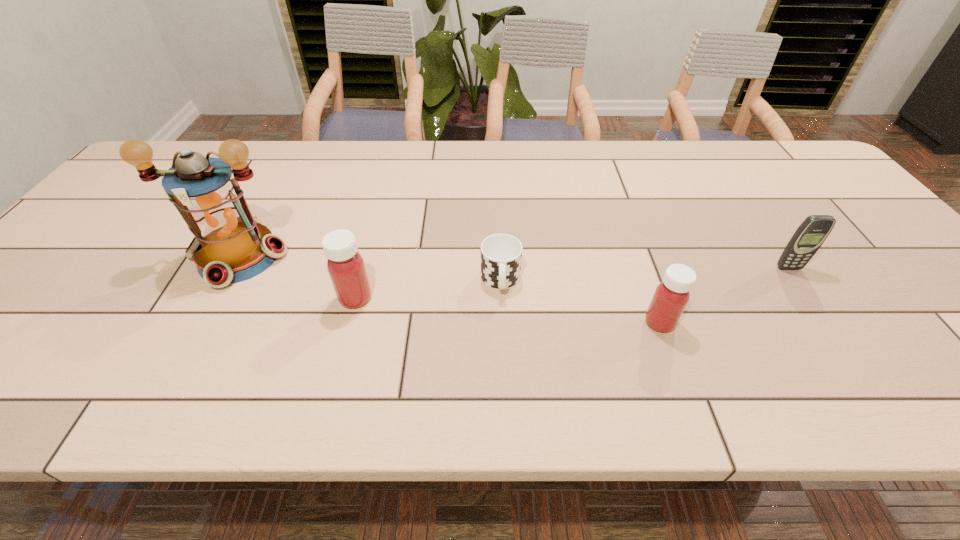
Locate an element on the screen. vacant region located on the screen of the cellular telephone is located at coordinates (848, 355).

Locate an element on the screen. vacant space located 0.100m on the side of the cup with the handle is located at coordinates (503, 338).

You are a GUI agent. You are given a task and a screenshot of the screen. Output one action in this format:
    pyautogui.click(x=<x>, y=<y>)
    Task: Click on the object that is at the near edge
    This screenshot has height=540, width=960.
    Given the screenshot: What is the action you would take?
    pyautogui.click(x=671, y=296)

In the image, there is a desktop. What are the coordinates of `blank space at the far edge` in the screenshot? It's located at (288, 143).

The image size is (960, 540). In order to click on vacant space at the near edge of the desktop in this screenshot , I will do `click(481, 334)`.

Where is `free space at the left edge`? The width and height of the screenshot is (960, 540). free space at the left edge is located at coordinates (84, 268).

In the image, there is a desktop. Identify the location of free space at the right edge. Image resolution: width=960 pixels, height=540 pixels. (849, 204).

You are a GUI agent. You are given a task and a screenshot of the screen. Output one action in this format:
    pyautogui.click(x=<x>, y=<y>)
    Task: Click on the free space at the far right corner
    
    Given the screenshot: What is the action you would take?
    pyautogui.click(x=772, y=158)

In the image, there is a desktop. At what (x,y) coordinates should I click in order to perform the action: click on vacant space at the near right corner. Please return your answer as a coordinate pair (x, y). Looking at the image, I should click on (911, 342).

Where is `vacant region between the right medicine and the third object from right to left`? This screenshot has height=540, width=960. vacant region between the right medicine and the third object from right to left is located at coordinates (580, 302).